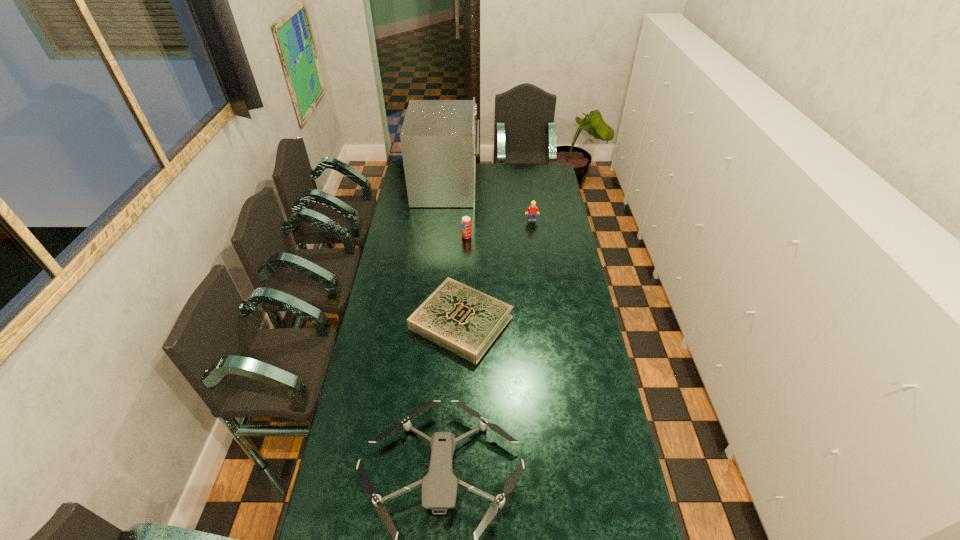
Locate an element on the screen. This screenshot has height=540, width=960. free space between the hardback book and the rightmost object is located at coordinates (496, 271).

Locate which object ranks fourth in proximity to the fourth nearest object. Please provide its 2D coordinates. Your answer should be formatted as a tuple, i.e. [(x, y)], where the tuple contains the x and y coordinates of a point satisfying the conditions above.

[(439, 487)]

Identify the location of object that is the third closest to the fourth farthest object. Image resolution: width=960 pixels, height=540 pixels. (531, 211).

Where is `vacant area that satisfies the following two spatial constraints: 1. on the back side of the soda can; 2. on the front panel of the tallest object`? vacant area that satisfies the following two spatial constraints: 1. on the back side of the soda can; 2. on the front panel of the tallest object is located at coordinates (468, 187).

Find the location of a particular element. The width and height of the screenshot is (960, 540). free space in the image that satisfies the following two spatial constraints: 1. on the front panel of the tallest object; 2. on the back side of the hardback book is located at coordinates (433, 322).

You are a GUI agent. You are given a task and a screenshot of the screen. Output one action in this format:
    pyautogui.click(x=<x>, y=<y>)
    Task: Click on the vacant space that satisfies the following two spatial constraints: 1. on the front panel of the third nearest object; 2. on the right side of the tallest object
    
    Given the screenshot: What is the action you would take?
    pyautogui.click(x=442, y=237)

Image resolution: width=960 pixels, height=540 pixels. I want to click on free spot that satisfies the following two spatial constraints: 1. on the front panel of the soda can; 2. on the right side of the toaster oven, so click(x=442, y=237).

At what (x,y) coordinates should I click in order to perform the action: click on free space that satisfies the following two spatial constraints: 1. on the front panel of the soda can; 2. on the right side of the toaster oven. Please return your answer as a coordinate pair (x, y). Image resolution: width=960 pixels, height=540 pixels. Looking at the image, I should click on (442, 237).

You are a GUI agent. You are given a task and a screenshot of the screen. Output one action in this format:
    pyautogui.click(x=<x>, y=<y>)
    Task: Click on the free space in the image that satisfies the following two spatial constraints: 1. on the back side of the shortest object; 2. on the front panel of the toaster oven
    
    Given the screenshot: What is the action you would take?
    pyautogui.click(x=467, y=187)

Where is `free spot that satisfies the following two spatial constraints: 1. on the front panel of the soda can; 2. on the left side of the tallest object`? This screenshot has height=540, width=960. free spot that satisfies the following two spatial constraints: 1. on the front panel of the soda can; 2. on the left side of the tallest object is located at coordinates (442, 237).